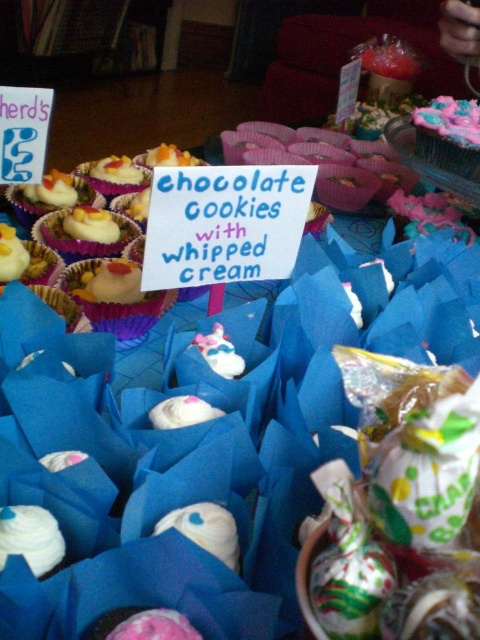
You are standing in front of the display of chocolate cookies and need to point out two specific points on the image. The first point is at coordinate point(133, 252) and the second is at point(86, 230). Which of these two points is closer to you?

Point(133, 252) is closer to the camera than point(86, 230).

You are at a bake sale and want to grab a matte white cupcake. You see both the matte white cupcake at center and the matte white cupcake at upper left. Which one is easier to reach without moving your current position?

The matte white cupcake at center is easier to reach because it is closer to you than the matte white cupcake at upper left.

You are at a bake sale and want to choose between the white frosted cupcake at center and the matte white cupcake at center. Which one is bigger?

The white frosted cupcake at center is larger in size compared to the matte white cupcake at center.